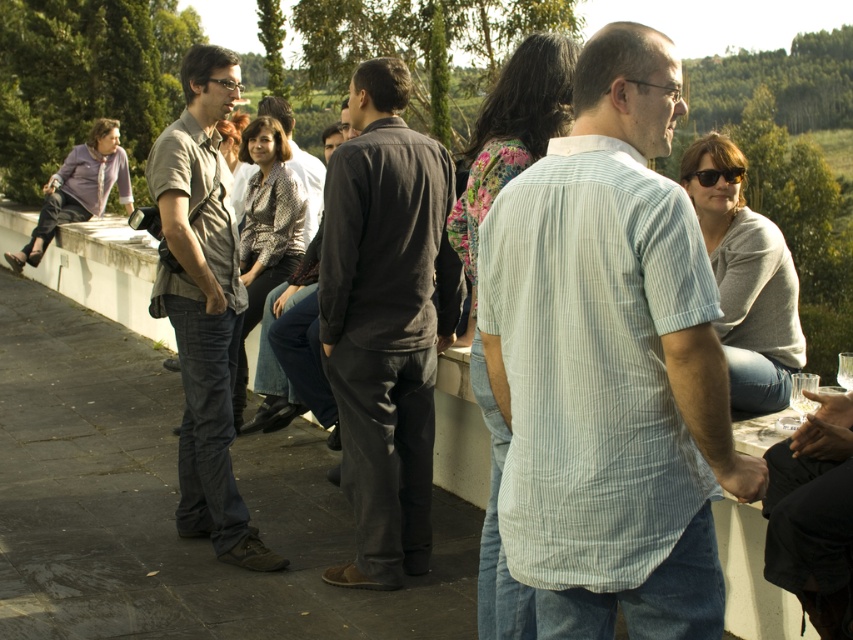
Question: Does light blue striped shirt at center have a smaller size compared to dark gray cotton shirt at center?

Choices:
 (A) no
 (B) yes

Answer: (A)

Question: Which of the following is the closest to the observer?

Choices:
 (A) (345, 164)
 (B) (312, 202)
 (C) (155, 166)
 (D) (631, 156)

Answer: (D)

Question: Does light blue striped shirt at center appear under denim jeans at center?

Choices:
 (A) yes
 (B) no

Answer: (A)

Question: Which object appears closest to the camera in this image?

Choices:
 (A) dark gray cotton shirt at center
 (B) metallic textured jacket at center
 (C) light blue striped shirt at center

Answer: (C)

Question: Estimate the real-world distances between objects in this image. Which object is closer to the light blue striped shirt at center?

Choices:
 (A) metallic textured jacket at center
 (B) dark gray cotton shirt at center

Answer: (B)

Question: Does denim jeans at center appear on the right side of metallic textured jacket at center?

Choices:
 (A) yes
 (B) no

Answer: (A)